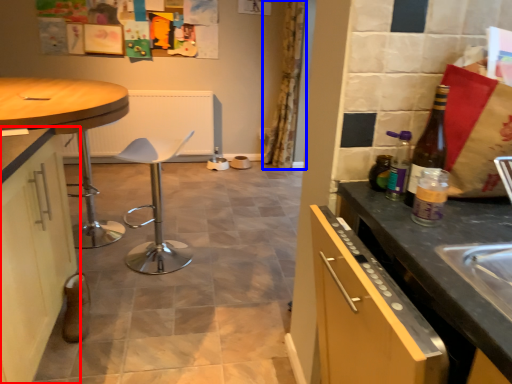
Question: Which of the following is the closest to the observer, cabinetry (highlighted by a red box) or curtain (highlighted by a blue box)?

Choices:
 (A) cabinetry
 (B) curtain

Answer: (A)